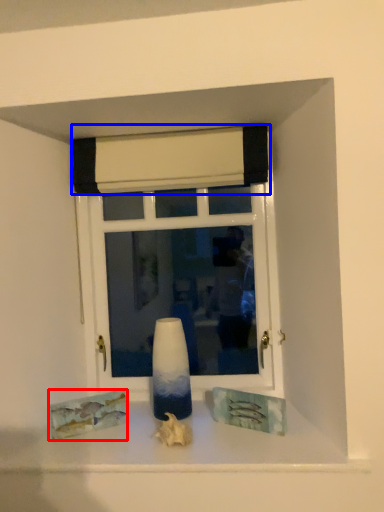
Question: Which object appears closest to the camera in this image, art (highlighted by a red box) or curtain (highlighted by a blue box)?

Choices:
 (A) art
 (B) curtain

Answer: (A)